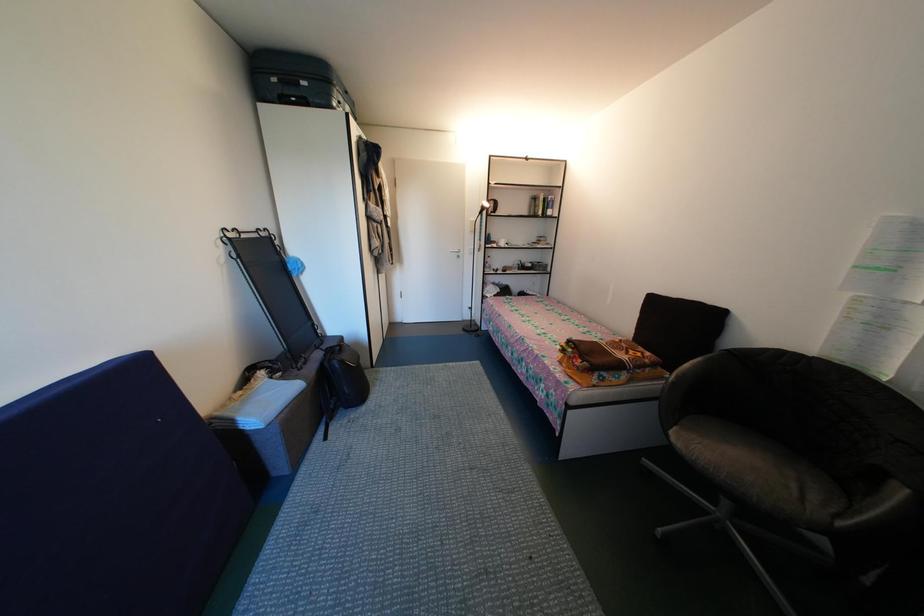
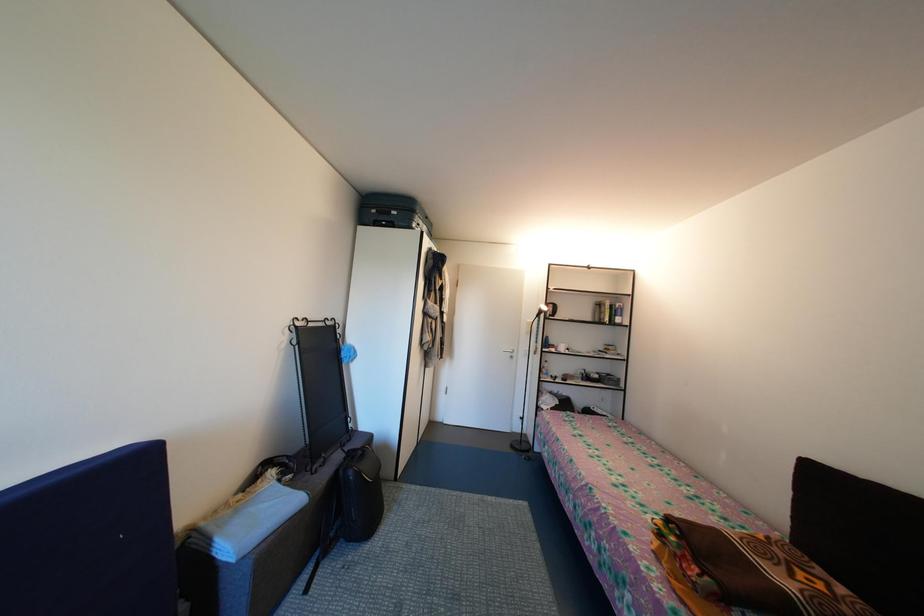
Question: The images are taken continuously from a first-person perspective. In which direction is your viewpoint rotating?

Choices:
 (A) Left
 (B) Right
 (C) Up
 (D) Down

Answer: (C)